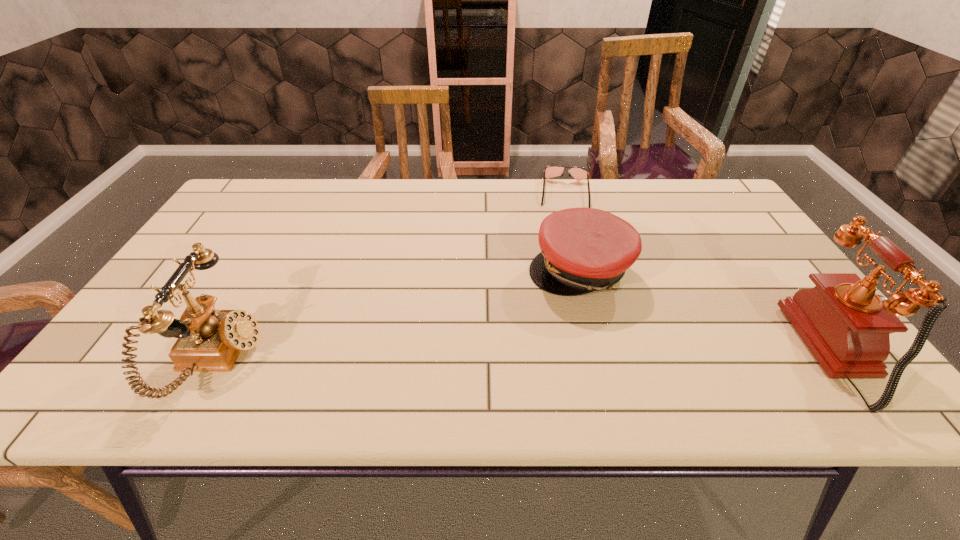
The image size is (960, 540). Find the location of `free space located 0.160m on the front-facing side of the third tallest object`. free space located 0.160m on the front-facing side of the third tallest object is located at coordinates (545, 348).

The image size is (960, 540). Identify the location of free spot located 0.380m on the bridge of the farthest object. (566, 295).

I want to click on blank space located on the bridge of the farthest object, so click(565, 229).

This screenshot has width=960, height=540. In order to click on vacant area situated 0.210m on the bridge of the farthest object in this screenshot , I will do `click(566, 252)`.

Locate an element on the screen. The image size is (960, 540). object that is at the far edge is located at coordinates (550, 171).

I want to click on object at the left edge, so tap(209, 340).

The image size is (960, 540). What are the coordinates of `object that is at the right edge` in the screenshot? It's located at (846, 326).

Locate an element on the screen. Image resolution: width=960 pixels, height=540 pixels. object that is at the near left corner is located at coordinates (209, 340).

In order to click on object located in the near right corner section of the desktop in this screenshot , I will do pos(846,326).

In the image, there is a desktop. Identify the location of vacant space at the far edge. (291, 187).